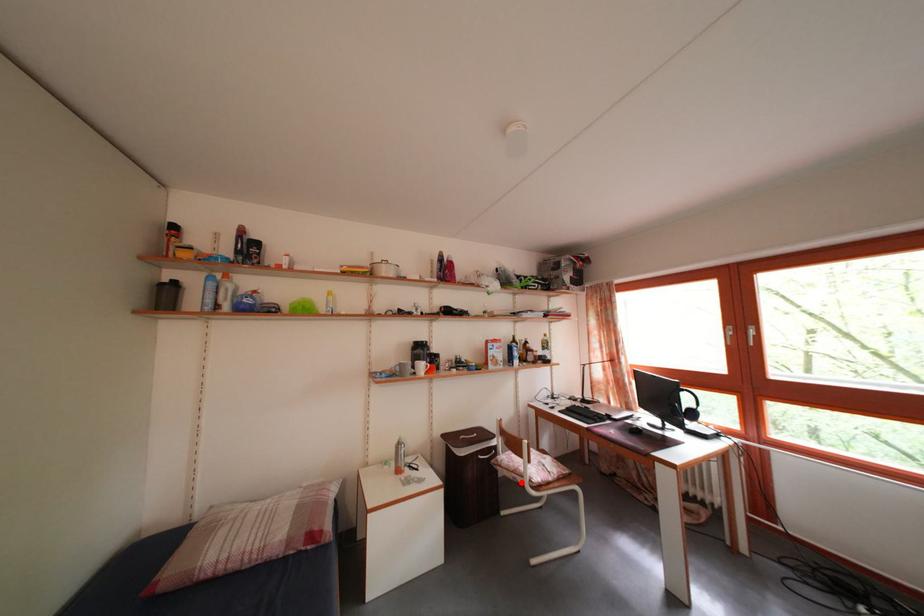
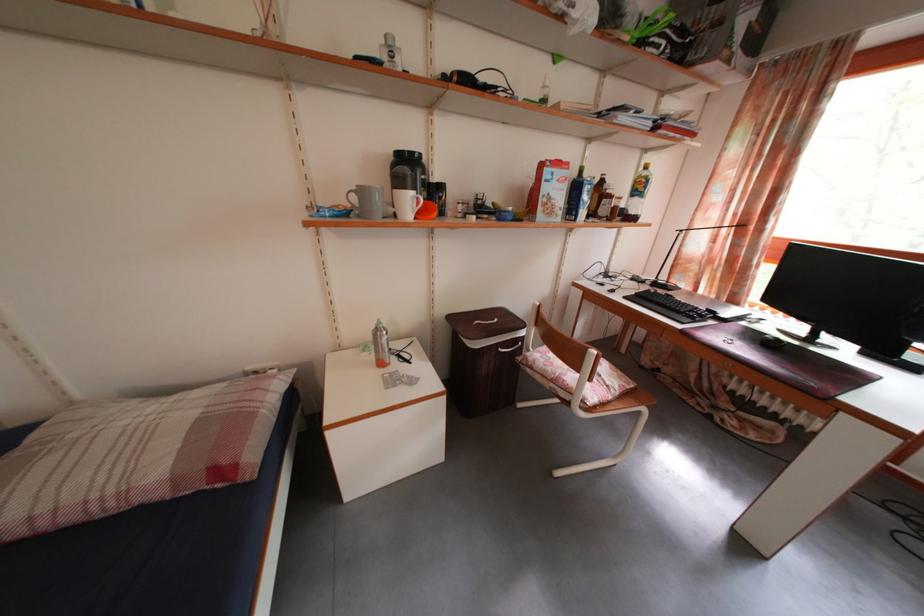
Question: I am providing you with two images of the same scene from different viewpoints. A red point is marked on the first image. Can you still see the location of the red point in image 2?

Choices:
 (A) Yes
 (B) No

Answer: (A)